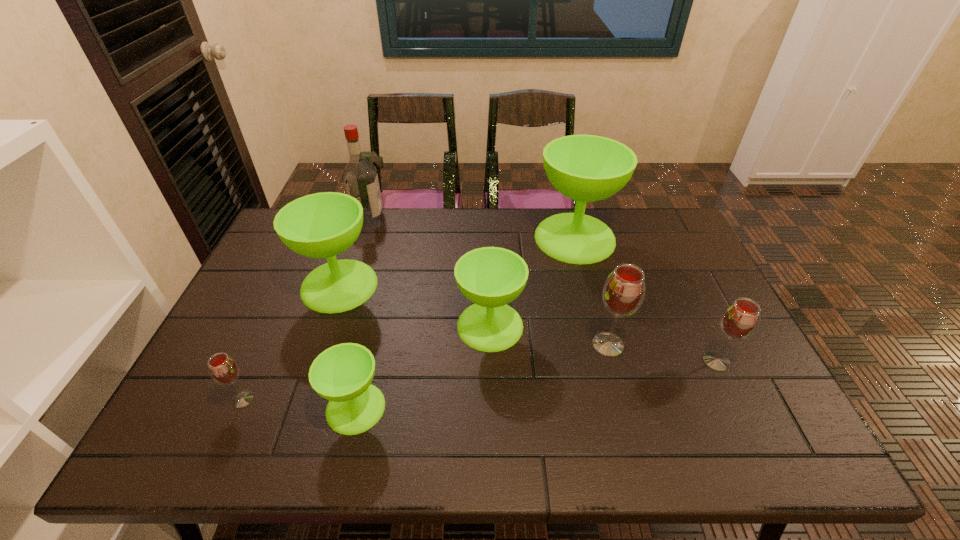
Where is `free spot between the second red wineglass from right to left and the second green wineglass from right to left`? The image size is (960, 540). free spot between the second red wineglass from right to left and the second green wineglass from right to left is located at coordinates (549, 335).

The image size is (960, 540). I want to click on free area in between the biggest red wineglass and the nearest green wineglass, so click(482, 376).

This screenshot has width=960, height=540. In order to click on blank region between the second red wineglass from left to right and the biggest green wineglass in this screenshot , I will do `click(591, 291)`.

Locate an element on the screen. empty space that is in between the tallest wineglass and the liquor is located at coordinates pyautogui.click(x=471, y=227).

Locate an element on the screen. This screenshot has height=540, width=960. unoccupied area between the second biggest red wineglass and the tallest wineglass is located at coordinates (645, 300).

Where is `object that is the third nearest to the second red wineglass from right to left`? object that is the third nearest to the second red wineglass from right to left is located at coordinates (586, 168).

Point out which object is positioned as the third nearest to the third biggest green wineglass. Please provide its 2D coordinates. Your answer should be formatted as a tuple, i.e. [(x, y)], where the tuple contains the x and y coordinates of a point satisfying the conditions above.

[(342, 374)]

Where is `wineglass that can be found as the third closest to the second smallest red wineglass`? Image resolution: width=960 pixels, height=540 pixels. wineglass that can be found as the third closest to the second smallest red wineglass is located at coordinates (490, 277).

Where is `wineglass that is the fifth closest to the biggest red wineglass`? Image resolution: width=960 pixels, height=540 pixels. wineglass that is the fifth closest to the biggest red wineglass is located at coordinates (322, 225).

Point out which green wineglass is positioned as the third nearest to the biggest red wineglass. Please provide its 2D coordinates. Your answer should be formatted as a tuple, i.e. [(x, y)], where the tuple contains the x and y coordinates of a point satisfying the conditions above.

[(342, 374)]